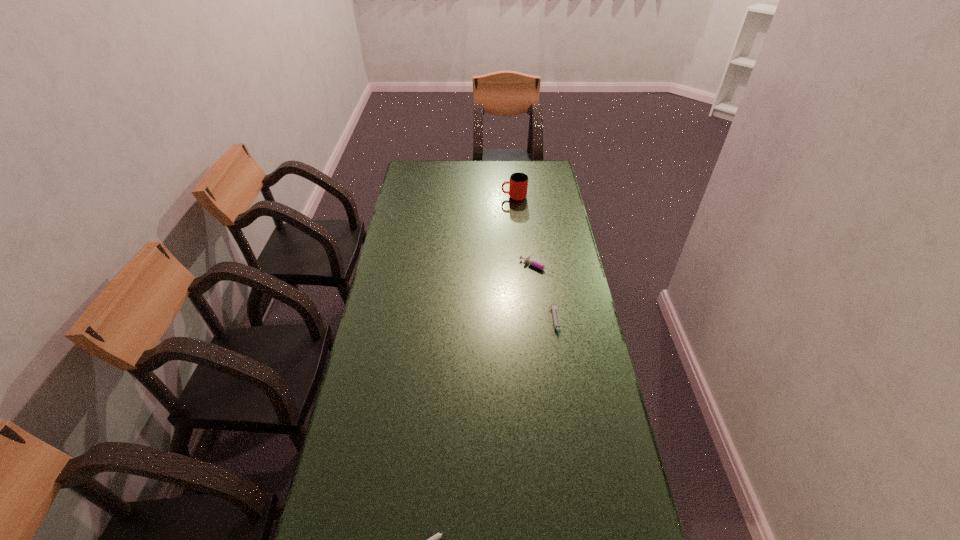
The image size is (960, 540). In order to click on empty location between the farthest object and the second farthest object in this screenshot , I will do `click(526, 232)`.

Locate an element on the screen. This screenshot has height=540, width=960. vacant space that is in between the tallest object and the farthest syringe is located at coordinates (526, 232).

What are the coordinates of `the second closest object to the leftmost syringe` in the screenshot? It's located at (528, 260).

You are a GUI agent. You are given a task and a screenshot of the screen. Output one action in this format:
    pyautogui.click(x=<x>, y=<y>)
    Task: Click on the third closest object relative to the nearest object
    The width and height of the screenshot is (960, 540).
    Given the screenshot: What is the action you would take?
    pyautogui.click(x=518, y=182)

This screenshot has width=960, height=540. Identify the location of the second closest syringe to the third nearest object. (434, 539).

Identify the location of the second closest syringe relative to the shortest object. (528, 260).